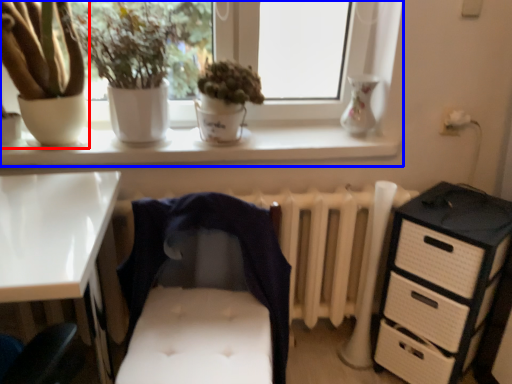
Question: Among these objects, which one is nearest to the camera, houseplant (highlighted by a red box) or window (highlighted by a blue box)?

Choices:
 (A) houseplant
 (B) window

Answer: (A)